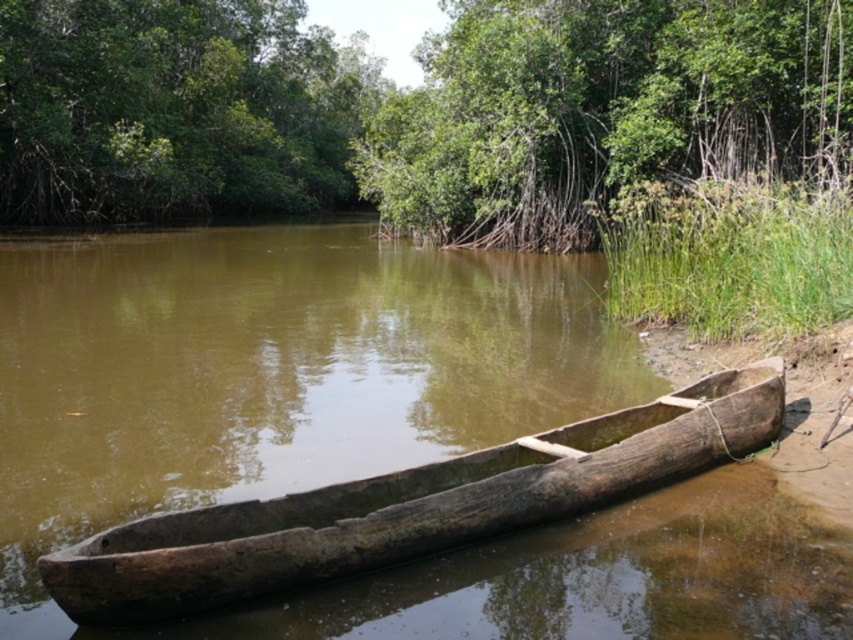
Can you confirm if green leafy trees at upper left is smaller than dark brown wood canoe at center?

No, green leafy trees at upper left is not smaller than dark brown wood canoe at center.

Is green leafy trees at upper left thinner than dark brown wood canoe at center?

No.

Which is behind, point (169, 184) or point (131, 621)?

The point (169, 184) is more distant.

You are a GUI agent. You are given a task and a screenshot of the screen. Output one action in this format:
    pyautogui.click(x=<x>, y=<y>)
    Task: Click on the green leafy trees at upper left
    
    Given the screenshot: What is the action you would take?
    pyautogui.click(x=173, y=109)

Locate an element on the screen. This screenshot has width=853, height=640. green leafy tree at upper center is located at coordinates (601, 109).

Can you confirm if green leafy tree at upper center is smaller than dark brown wood canoe at center?

No.

This screenshot has width=853, height=640. Find the location of `green leafy tree at upper center`. green leafy tree at upper center is located at coordinates (601, 109).

Can you confirm if green leafy tree at upper center is thinner than green leafy trees at upper left?

No.

Locate an element on the screen. The width and height of the screenshot is (853, 640). green leafy tree at upper center is located at coordinates (601, 109).

Describe the element at coordinates (601, 109) in the screenshot. I see `green leafy tree at upper center` at that location.

The width and height of the screenshot is (853, 640). I want to click on green leafy tree at upper center, so click(x=601, y=109).